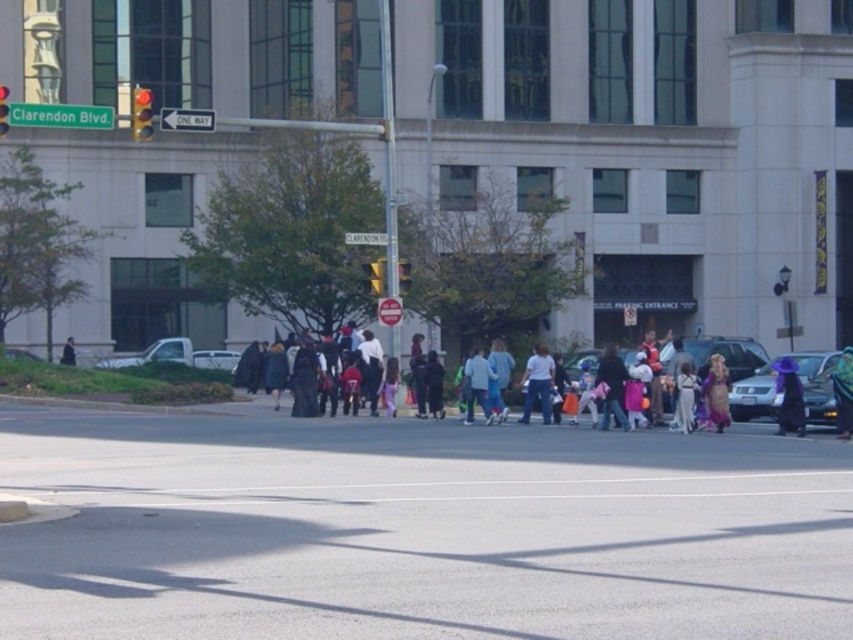
Question: Does matte black costume at center have a greater width compared to red glass traffic light at upper left?

Choices:
 (A) no
 (B) yes

Answer: (A)

Question: Is metallic silver car at center-right positioned before yellow plastic traffic light at center?

Choices:
 (A) no
 (B) yes

Answer: (B)

Question: Which object is positioned closest to the light blue fabric pants at center?

Choices:
 (A) light blue fabric jacket at center
 (B) shiny gold dress at center

Answer: (A)

Question: Observing the image, what is the correct spatial positioning of light blue fabric pants at center in reference to yellow matte traffic light at center?

Choices:
 (A) below
 (B) above

Answer: (A)

Question: Which point is farther from the camera taking this photo?

Choices:
 (A) (509, 355)
 (B) (772, 584)
 (C) (775, 362)

Answer: (A)

Question: Which point is closer to the camera?

Choices:
 (A) (61, 355)
 (B) (720, 397)
 (C) (370, 275)
 (D) (141, 118)

Answer: (B)